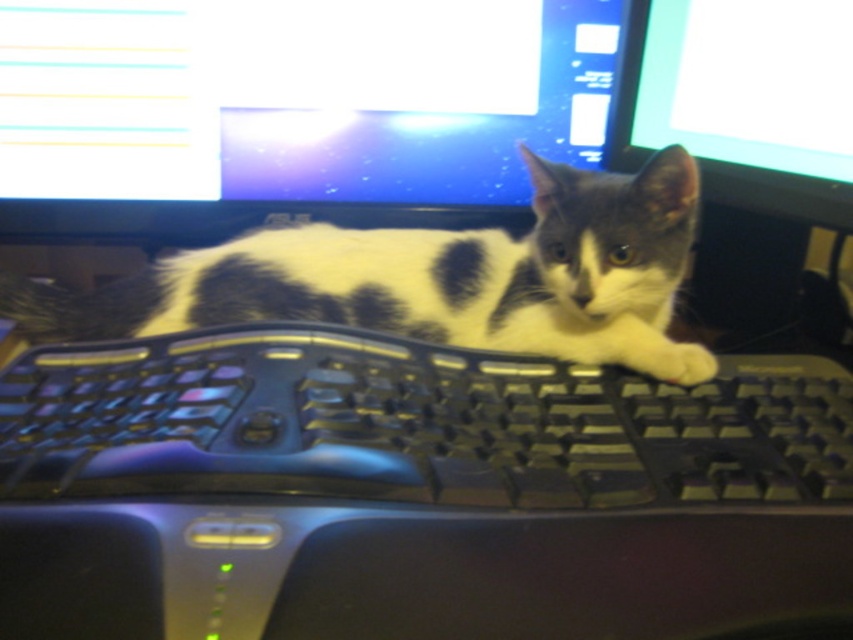
From the picture: You are setting up a workspace and need to place the black plastic keyboard at center and the matte black monitor at upper right. Given their sizes, which object should be placed first to ensure proper positioning?

The black plastic keyboard at center is larger in size than the matte black monitor at upper right, so it should be placed first to accommodate its larger footprint.

You are trying to locate two points on the keyboard in the image. The first point is at coordinates point (x=494, y=58) and the second is at point (x=782, y=74). From the perspective of someone sitting at the computer, which point is closer to the back of the keyboard?

Point (x=494, y=58) is behind point (x=782, y=74), so the point closer to the back of the keyboard is point (x=494, y=58).